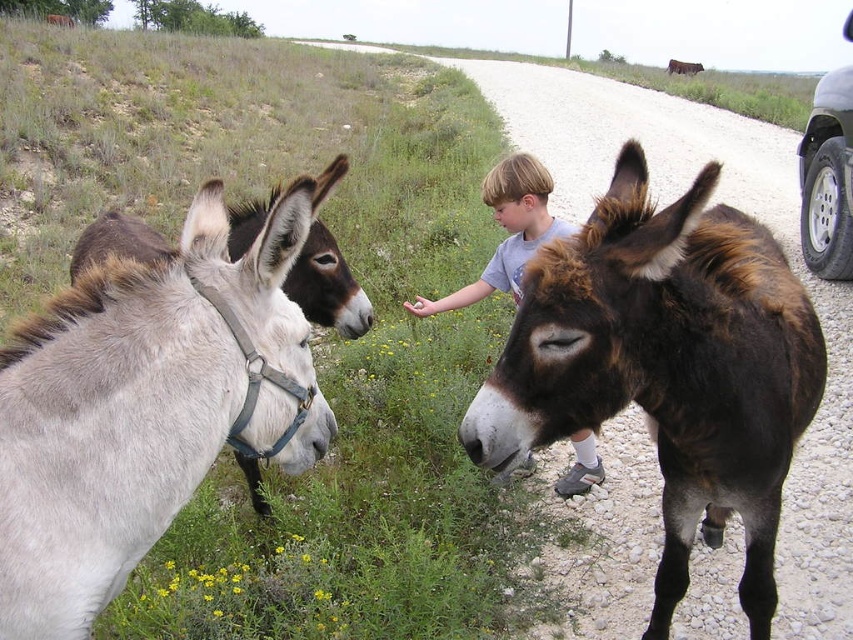
Question: Is brown fuzzy donkey at right closer to camera compared to metallic gray tire at right?

Choices:
 (A) no
 (B) yes

Answer: (B)

Question: Can you confirm if light gray t-shirt at center is positioned to the right of metallic gray tire at right?

Choices:
 (A) yes
 (B) no

Answer: (B)

Question: Does brown fuzzy donkey at right have a smaller size compared to brown fuzzy mule at right?

Choices:
 (A) yes
 (B) no

Answer: (A)

Question: Which point appears closest to the camera in this image?

Choices:
 (A) (666, 381)
 (B) (679, 65)
 (C) (340, 278)

Answer: (A)

Question: Which object appears closest to the camera in this image?

Choices:
 (A) brown fuzzy mule at right
 (B) light gray t-shirt at center

Answer: (B)

Question: Among these points, which one is farthest from the camera?

Choices:
 (A) (819, 388)
 (B) (434, 308)
 (C) (849, 243)

Answer: (C)